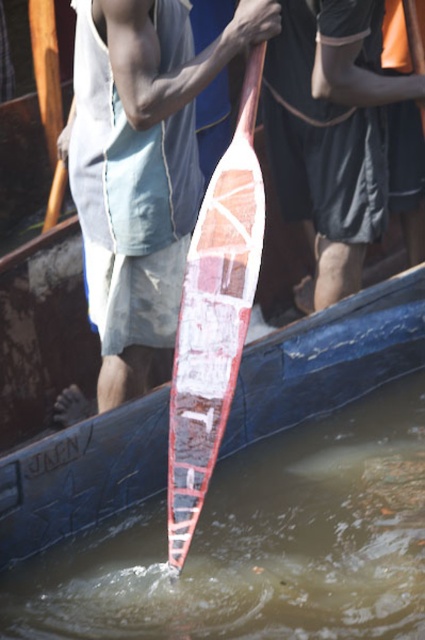
Is translucent water at paddle center wider than matte white paddle at center?

Indeed, translucent water at paddle center has a greater width compared to matte white paddle at center.

Who is more forward, (x=217, y=541) or (x=136, y=42)?

Point (x=136, y=42) is in front.

Find the location of a particular element. translucent water at paddle center is located at coordinates (257, 545).

Between matte white paddle at center and wooden surfboard at center, which one appears on the right side from the viewer's perspective?

wooden surfboard at center

Is point (101, 10) positioned after point (189, 444)?

No.

Find the location of a particular element. matte white paddle at center is located at coordinates (138, 304).

Can you confirm if translucent water at paddle center is smaller than wooden surfboard at center?

Actually, translucent water at paddle center might be larger than wooden surfboard at center.

Locate an element on the screen. This screenshot has height=640, width=425. translucent water at paddle center is located at coordinates (257, 545).